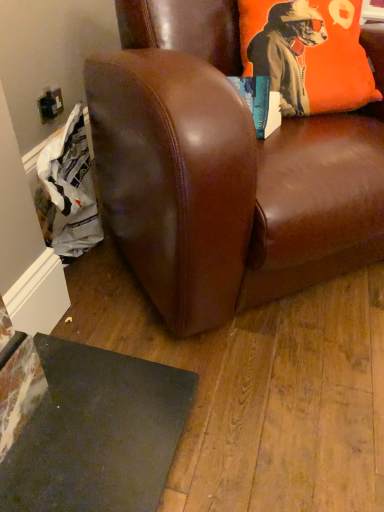
What do you see at coordinates (222, 170) in the screenshot? The height and width of the screenshot is (512, 384). I see `brown leather chair at center` at bounding box center [222, 170].

The width and height of the screenshot is (384, 512). Find the location of `brown leather chair at center`. brown leather chair at center is located at coordinates (222, 170).

Where is `orange fabric pillow at upper right`? The width and height of the screenshot is (384, 512). orange fabric pillow at upper right is located at coordinates (307, 53).

The width and height of the screenshot is (384, 512). Describe the element at coordinates (307, 53) in the screenshot. I see `orange fabric pillow at upper right` at that location.

Locate an element on the screen. brown leather chair at center is located at coordinates (222, 170).

Considering the positions of objects orange fabric pillow at upper right and brown leather chair at center in the image provided, who is more to the right, orange fabric pillow at upper right or brown leather chair at center?

orange fabric pillow at upper right is more to the right.

Does orange fabric pillow at upper right come in front of brown leather chair at center?

No.

Between point (347, 101) and point (376, 135), which one is positioned in front?

The point (376, 135) is closer.

From the image's perspective, between orange fabric pillow at upper right and brown leather chair at center, which one is located above?

orange fabric pillow at upper right is shown above in the image.

From a real-world perspective, between orange fabric pillow at upper right and brown leather chair at center, who is vertically lower?

brown leather chair at center, from a real-world perspective.

Considering the relative sizes of orange fabric pillow at upper right and brown leather chair at center in the image provided, is orange fabric pillow at upper right wider than brown leather chair at center?

In fact, orange fabric pillow at upper right might be narrower than brown leather chair at center.

From the picture: Who is shorter, orange fabric pillow at upper right or brown leather chair at center?

orange fabric pillow at upper right is shorter.

Considering the sizes of objects orange fabric pillow at upper right and brown leather chair at center in the image provided, who is smaller, orange fabric pillow at upper right or brown leather chair at center?

orange fabric pillow at upper right.

Is orange fabric pillow at upper right inside the boundaries of brown leather chair at center, or outside?

orange fabric pillow at upper right can be found inside brown leather chair at center.

Is there a large distance between orange fabric pillow at upper right and brown leather chair at center?

orange fabric pillow at upper right is actually quite close to brown leather chair at center.

Is orange fabric pillow at upper right looking in the opposite direction of brown leather chair at center?

Yes.

Measure the distance from orange fabric pillow at upper right to brown leather chair at center.

A distance of 10.29 inches exists between orange fabric pillow at upper right and brown leather chair at center.

Identify the location of chair on the left side of orange fabric pillow at upper right. The image size is (384, 512). (222, 170).

Considering the relative positions of brown leather chair at center and orange fabric pillow at upper right in the image provided, is brown leather chair at center to the left of orange fabric pillow at upper right from the viewer's perspective?

Yes, brown leather chair at center is to the left of orange fabric pillow at upper right.

Is the depth of brown leather chair at center greater than that of orange fabric pillow at upper right?

No, brown leather chair at center is closer to the camera.

Is point (184, 247) closer to viewer compared to point (356, 87)?

Yes, point (184, 247) is closer to viewer.

From the image's perspective, is brown leather chair at center located above or below orange fabric pillow at upper right?

brown leather chair at center is below orange fabric pillow at upper right.

From a real-world perspective, between brown leather chair at center and orange fabric pillow at upper right, who is vertically lower?

brown leather chair at center.

Is brown leather chair at center wider than orange fabric pillow at upper right?

Indeed, brown leather chair at center has a greater width compared to orange fabric pillow at upper right.

In terms of height, does brown leather chair at center look taller or shorter compared to orange fabric pillow at upper right?

brown leather chair at center is taller than orange fabric pillow at upper right.

Based on the photo, looking at the image, does brown leather chair at center seem bigger or smaller compared to orange fabric pillow at upper right?

Clearly, brown leather chair at center is larger in size than orange fabric pillow at upper right.

Is brown leather chair at center located outside orange fabric pillow at upper right?

Yes, brown leather chair at center is outside of orange fabric pillow at upper right.

Would you consider brown leather chair at center to be distant from orange fabric pillow at upper right?

No, there isn't a large distance between brown leather chair at center and orange fabric pillow at upper right.

Could you tell me if brown leather chair at center is turned towards orange fabric pillow at upper right?

Yes, brown leather chair at center is facing orange fabric pillow at upper right.

Can you tell me how much brown leather chair at center and orange fabric pillow at upper right differ in facing direction?

They differ by 30.5 degrees in their facing directions.

Where is `pillow on the right of brown leather chair at center`? pillow on the right of brown leather chair at center is located at coordinates (307, 53).

Identify the location of pillow behind the brown leather chair at center. Image resolution: width=384 pixels, height=512 pixels. (307, 53).

The height and width of the screenshot is (512, 384). In order to click on pillow on the right side of brown leather chair at center in this screenshot , I will do `click(307, 53)`.